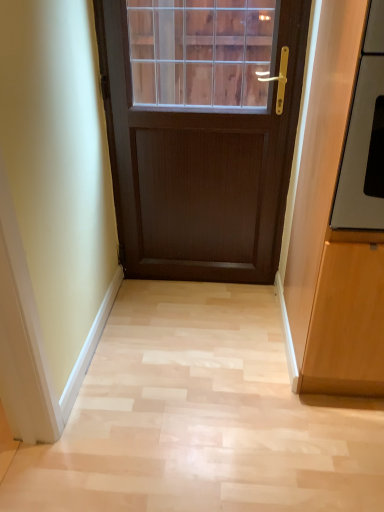
Question: From a real-world perspective, is matte wood cabinet at right physically located above or below satin silver oven at right?

Choices:
 (A) below
 (B) above

Answer: (A)

Question: Choose the correct answer: Is matte wood cabinet at right inside satin silver oven at right or outside it?

Choices:
 (A) outside
 (B) inside

Answer: (A)

Question: Which object is the farthest from the satin silver oven at right?

Choices:
 (A) matte wood cabinet at right
 (B) light wood floor at center

Answer: (B)

Question: Which is nearer to the matte wood cabinet at right?

Choices:
 (A) light wood floor at center
 (B) satin silver oven at right

Answer: (B)